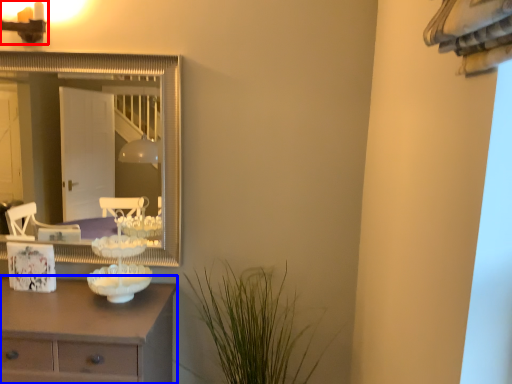
Question: Which object is closer to the camera taking this photo, light fixture (highlighted by a red box) or chest of drawers (highlighted by a blue box)?

Choices:
 (A) light fixture
 (B) chest of drawers

Answer: (B)